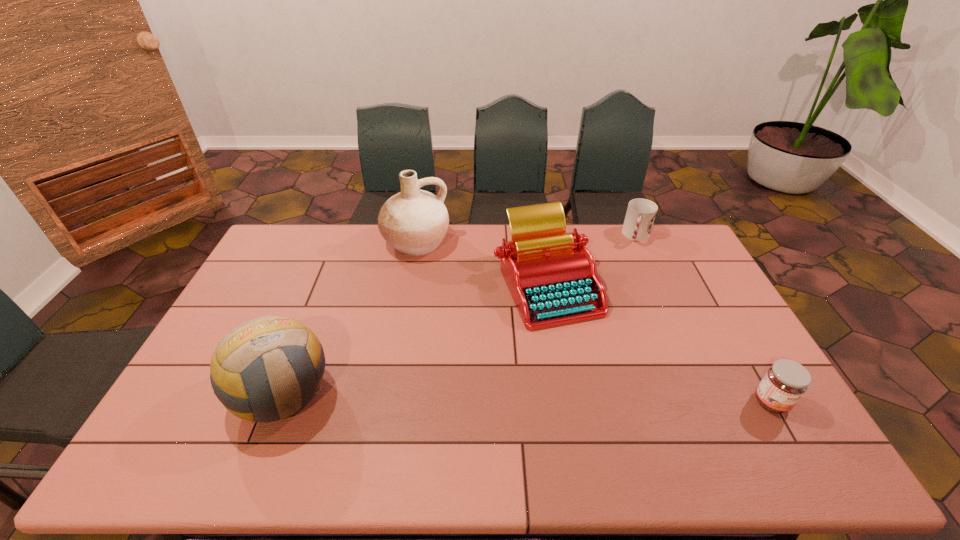
Find the location of a particular element. The width and height of the screenshot is (960, 540). cup that is positioned at the far edge is located at coordinates (640, 215).

At what (x,y) coordinates should I click in order to perform the action: click on pottery present at the far edge. Please return your answer as a coordinate pair (x, y). Image resolution: width=960 pixels, height=540 pixels. Looking at the image, I should click on (414, 222).

The height and width of the screenshot is (540, 960). Find the location of `volleyball located in the near edge section of the desktop`. volleyball located in the near edge section of the desktop is located at coordinates (267, 369).

The width and height of the screenshot is (960, 540). Find the location of `jam that is at the near edge`. jam that is at the near edge is located at coordinates (785, 382).

The image size is (960, 540). In order to click on object located in the left edge section of the desktop in this screenshot , I will do `click(267, 369)`.

At what (x,y) coordinates should I click in order to perform the action: click on jam present at the right edge. Please return your answer as a coordinate pair (x, y). The height and width of the screenshot is (540, 960). Looking at the image, I should click on (785, 382).

Find the location of a particular element. cup present at the right edge is located at coordinates (640, 215).

Identify the location of object at the near left corner. (267, 369).

What are the coordinates of `object located at the far right corner` in the screenshot? It's located at (640, 215).

Find the location of `object positioned at the near right corner`. object positioned at the near right corner is located at coordinates (785, 382).